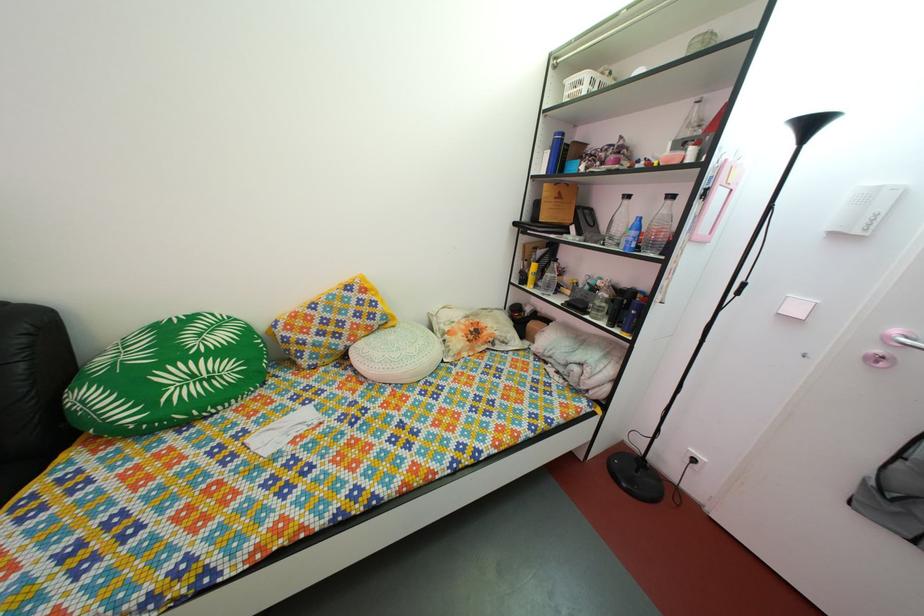
The width and height of the screenshot is (924, 616). Find the location of `black sofa armrest`. black sofa armrest is located at coordinates (27, 408).